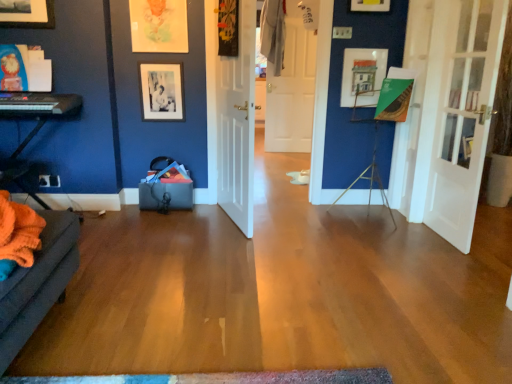
Locate an element on the screen. The width and height of the screenshot is (512, 384). free point to the left of white wooden door at center, positioned as the second door in back-to-front order is located at coordinates (173, 225).